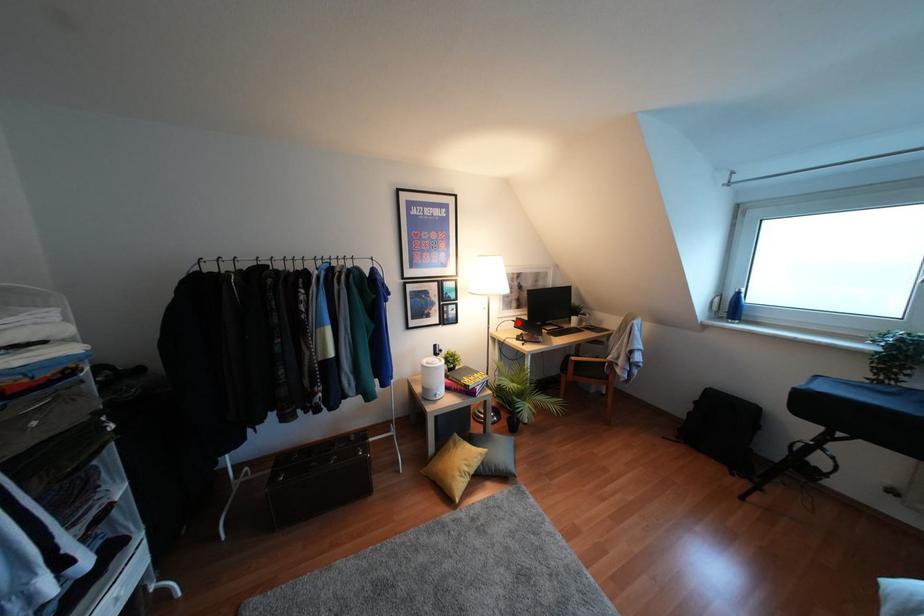
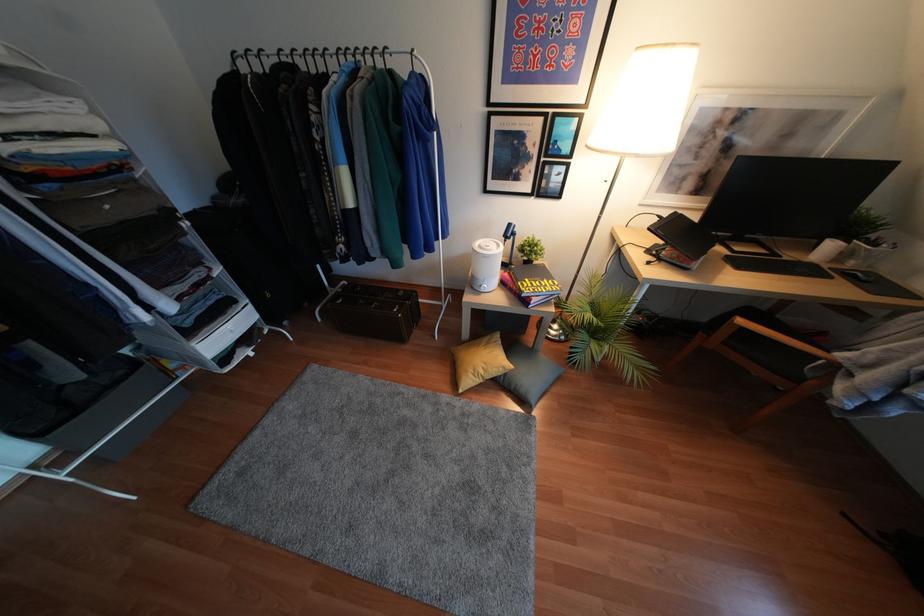
Locate, in the second image, the point that corresponds to the highlighted location in the first image.

(666, 224)